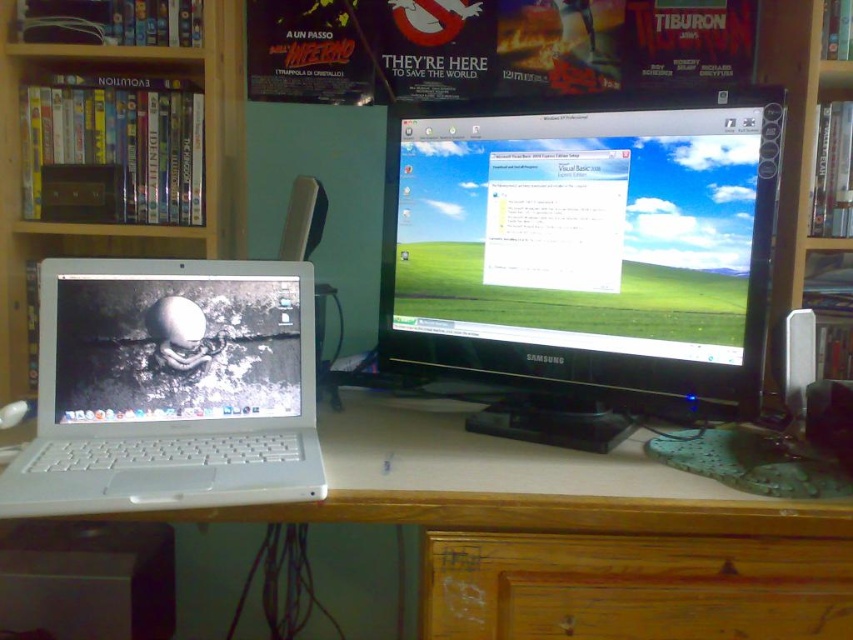
You are standing in front of a desk with a laptop on the left and a Samsung desktop monitor on the right. There is a point at coordinates point [537,618]. If you want to place a 12 inch wide object on the desk, will it fit between you and this point?

The distance between you and the point [537,618] is 32.77 inches, so yes, a 12 inch wide object will fit comfortably within that space.

You are organizing the desk and need to move the white plastic laptop at left. Since it is currently placed over the wooden drawer at lower center, where should you move it to avoid blocking the drawer?

The white plastic laptop at left should be moved away from the wooden drawer at lower center to ensure it is not blocking the drawer when opened.

You are a photographer taking a picture of the workspace. You want to focus on the point that is closer to the camera. Which point should you choose between point (x=74, y=339) and point (x=233, y=312)?

Point (x=74, y=339) is closer to the camera than point (x=233, y=312), so you should choose point (x=74, y=339) to focus on.